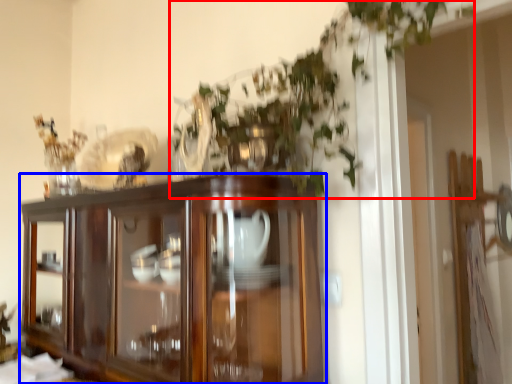
Question: Which point is closer to the camera, vegetation (highlighted by a red box) or cupboard (highlighted by a blue box)?

Choices:
 (A) vegetation
 (B) cupboard

Answer: (A)